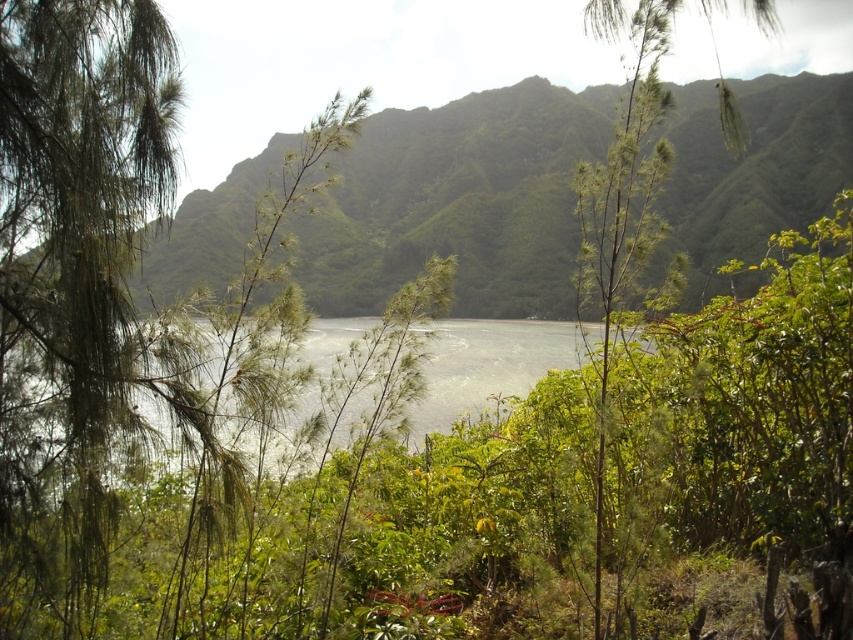
You are a hiker standing at the edge of the tropical landscape. You notice the green leafy hillside at upper center and the green leafy tree at center. Which of these two features has a greater width from your viewpoint?

The green leafy hillside at upper center is wider than the green leafy tree at center according to the description.

You are standing at the center of the image and want to locate the green leafy tree at center. What are its coordinates?

The green leafy tree at center is located at coordinates point (622, 196).